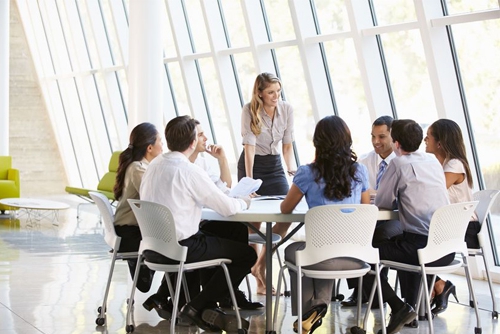
Image resolution: width=500 pixels, height=334 pixels. What are the coordinates of `chairs` in the screenshot? It's located at (486, 201), (454, 228), (357, 221), (160, 230), (111, 227), (108, 177), (9, 182).